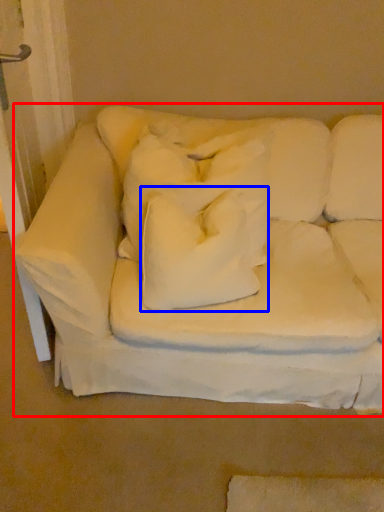
Question: Which object appears farthest to the camera in this image, studio couch (highlighted by a red box) or pillow (highlighted by a blue box)?

Choices:
 (A) studio couch
 (B) pillow

Answer: (B)